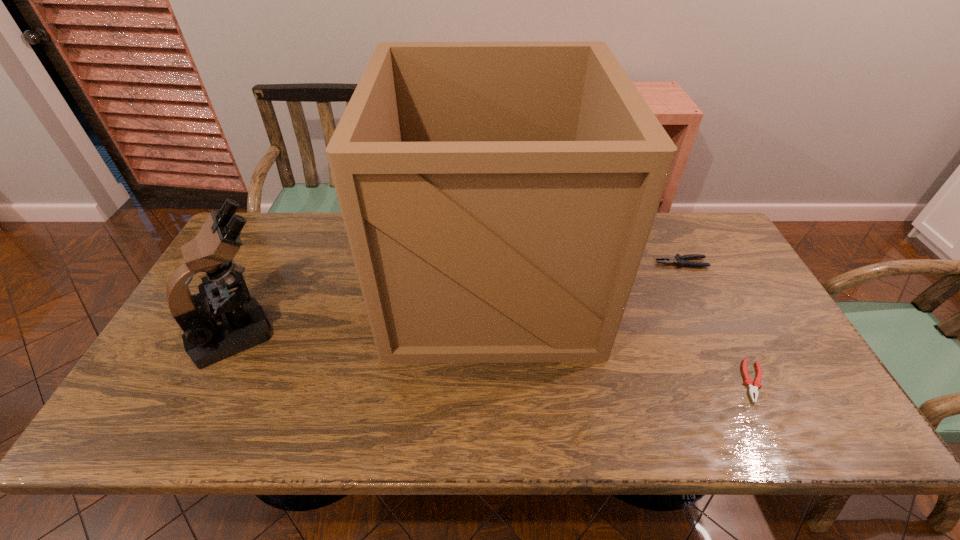
In order to click on vacant region at the near edge of the desktop in this screenshot , I will do `click(605, 408)`.

This screenshot has width=960, height=540. In the image, there is a desktop. What are the coordinates of `vacant space at the right edge` in the screenshot? It's located at (732, 272).

Where is `vacant area between the tallest object and the nearer pliers`? This screenshot has height=540, width=960. vacant area between the tallest object and the nearer pliers is located at coordinates (622, 332).

Identify the location of free point between the third tallest object and the nearer pliers. (717, 322).

The height and width of the screenshot is (540, 960). Find the location of `vacant area between the microscope and the tallest object`. vacant area between the microscope and the tallest object is located at coordinates (365, 308).

The width and height of the screenshot is (960, 540). Find the location of `free area in between the farther pliers and the shorter pliers`. free area in between the farther pliers and the shorter pliers is located at coordinates (717, 322).

Locate which object ranks in proximity to the third object from right to left. Please provide its 2D coordinates. Your answer should be formatted as a tuple, i.e. [(x, y)], where the tuple contains the x and y coordinates of a point satisfying the conditions above.

[(679, 260)]

You are a GUI agent. You are given a task and a screenshot of the screen. Output one action in this format:
    pyautogui.click(x=<x>, y=<y>)
    Task: Click on the closest object to the farther pliers
    This screenshot has height=540, width=960.
    Given the screenshot: What is the action you would take?
    pyautogui.click(x=498, y=197)

The height and width of the screenshot is (540, 960). What are the coordinates of `blank area in the image that satisfies the following two spatial constraints: 1. on the back side of the nearer pliers; 2. at the gripping part of the farther pliers` in the screenshot? It's located at (693, 263).

I want to click on blank space that satisfies the following two spatial constraints: 1. at the gripping part of the third tallest object; 2. on the left side of the shorter pliers, so click(x=739, y=381).